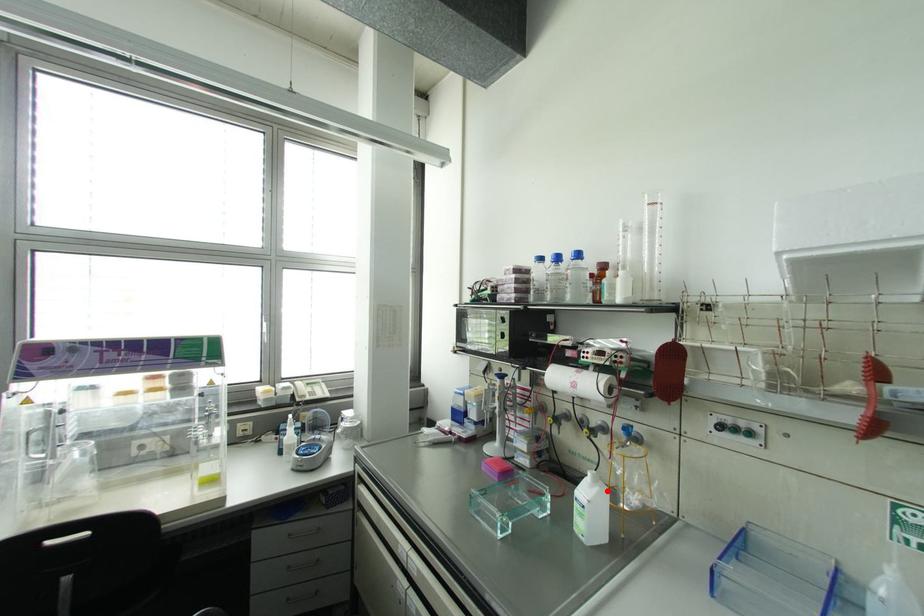
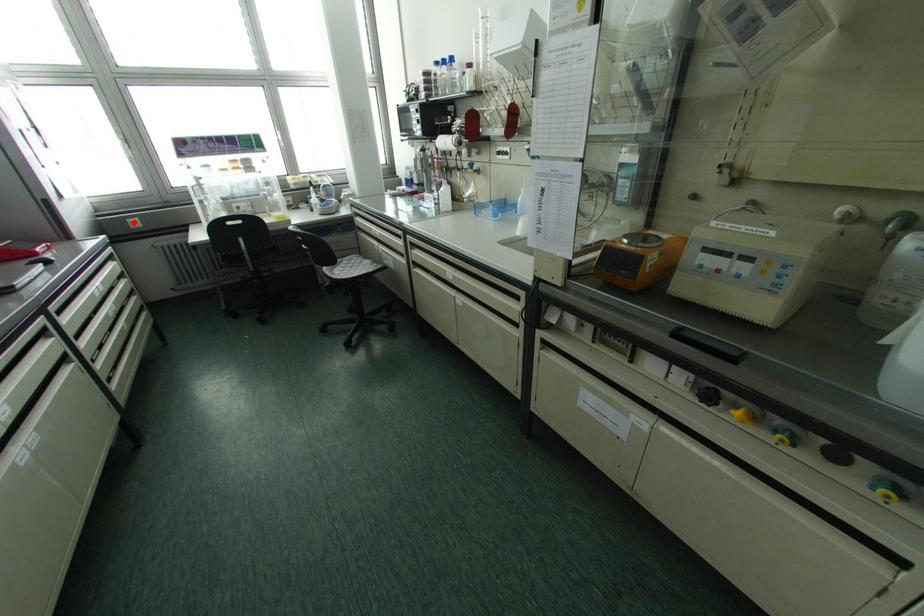
I am providing you with two images of the same scene from different viewpoints. A red point is marked on the first image and another point is marked on the second image. Is the red point in image1 aligned with the point shown in image2?

No